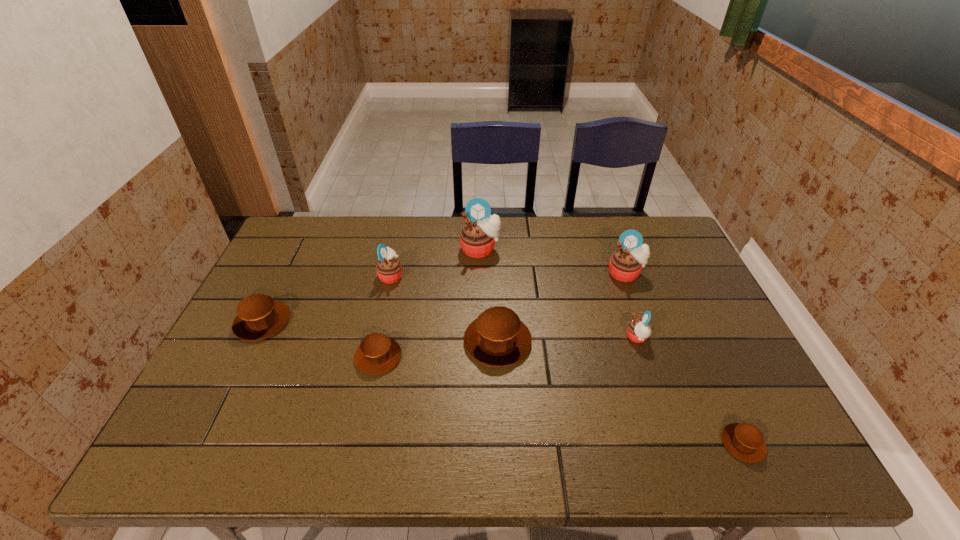
Where is `vacant region located 0.160m on the front of the leftmost object`? The image size is (960, 540). vacant region located 0.160m on the front of the leftmost object is located at coordinates (227, 395).

What are the coordinates of `vacant space located on the front of the third biggest brown muffin` in the screenshot? It's located at coord(370,397).

The image size is (960, 540). What are the coordinates of `free spot located 0.260m on the left of the smallest brown muffin` in the screenshot? It's located at (602, 443).

Find the location of a particular element. This screenshot has width=960, height=540. object situated at the far edge is located at coordinates click(481, 230).

Identify the location of object positioned at the near edge. (745, 441).

Find the location of a particular element. This screenshot has height=540, width=960. object located at the left edge is located at coordinates (259, 316).

The height and width of the screenshot is (540, 960). Find the location of `object that is at the near right corner`. object that is at the near right corner is located at coordinates [745, 441].

Locate an element on the screen. The height and width of the screenshot is (540, 960). free space at the far edge of the desktop is located at coordinates (535, 228).

Find the location of a particular element. This screenshot has height=540, width=960. free space at the near edge of the desktop is located at coordinates (271, 449).

This screenshot has width=960, height=540. I want to click on free region at the left edge, so click(x=283, y=342).